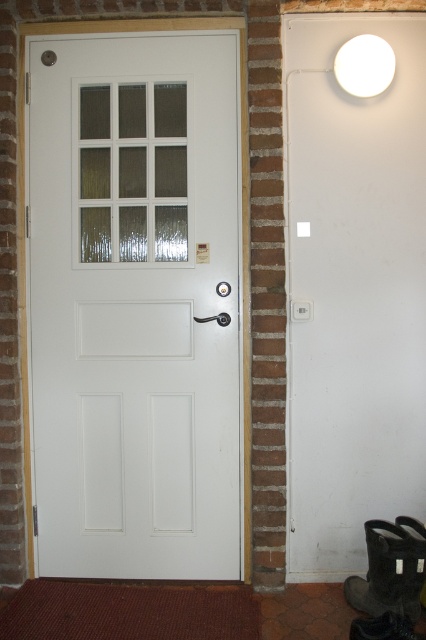
You are standing in front of the building shown in the image. The white matte door at center is your target. If you were to approach the door from the front, which direction should you walk to reach it?

Since the white matte door at center is located at point coordinates, you should walk directly towards the center of the building where the white matte door at center is positioned.

You are a delivery person with a 1 meter wide cart. You need to navigate through the area shown in the image. Can your cart fit between the white matte door at center and the white matte light fixture at upper right?

The distance between the white matte door at center and the white matte light fixture at upper right is 86.57 centimeters, which is less than the cart width of 1 meter. Therefore, the cart cannot fit through the space between them.